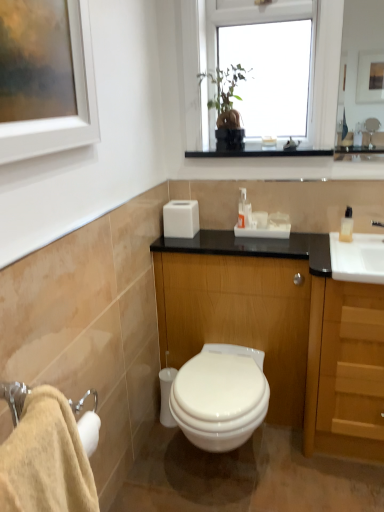
You are a GUI agent. You are given a task and a screenshot of the screen. Output one action in this format:
    pyautogui.click(x=<x>, y=<y>)
    Task: Click on the vacant region in front of clear plastic soap dispenser at right
    The height and width of the screenshot is (512, 384).
    Given the screenshot: What is the action you would take?
    pyautogui.click(x=362, y=259)